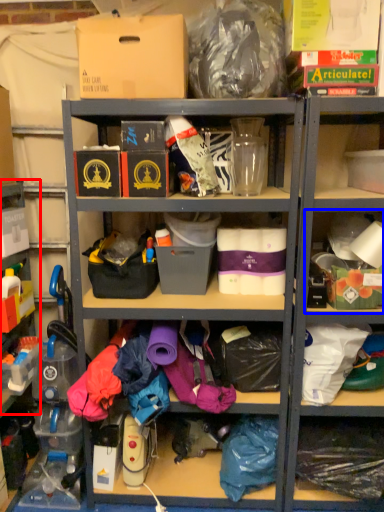
Question: Which object is further to the camera taking this photo, shelf (highlighted by a red box) or shelf (highlighted by a blue box)?

Choices:
 (A) shelf
 (B) shelf

Answer: (B)